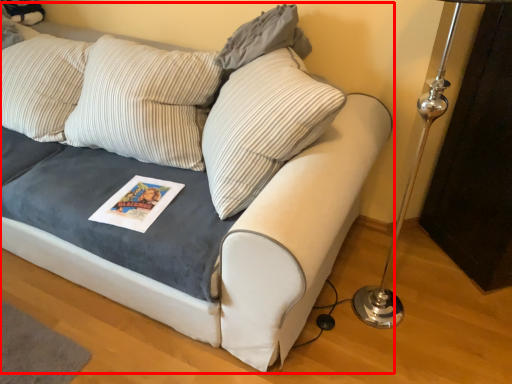
Question: From the image's perspective, what is the correct spatial positioning of studio couch (annotated by the red box) in reference to pillow?

Choices:
 (A) below
 (B) above

Answer: (A)